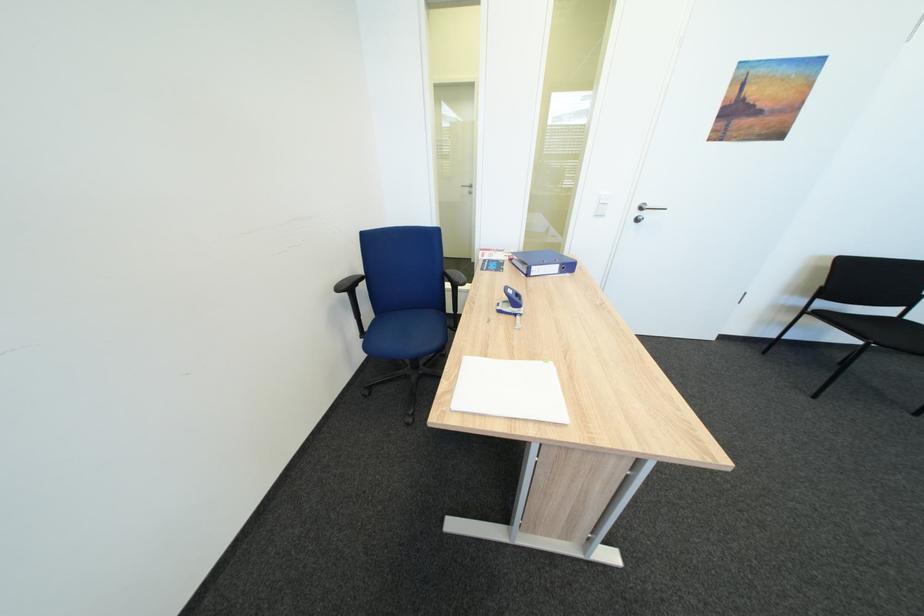
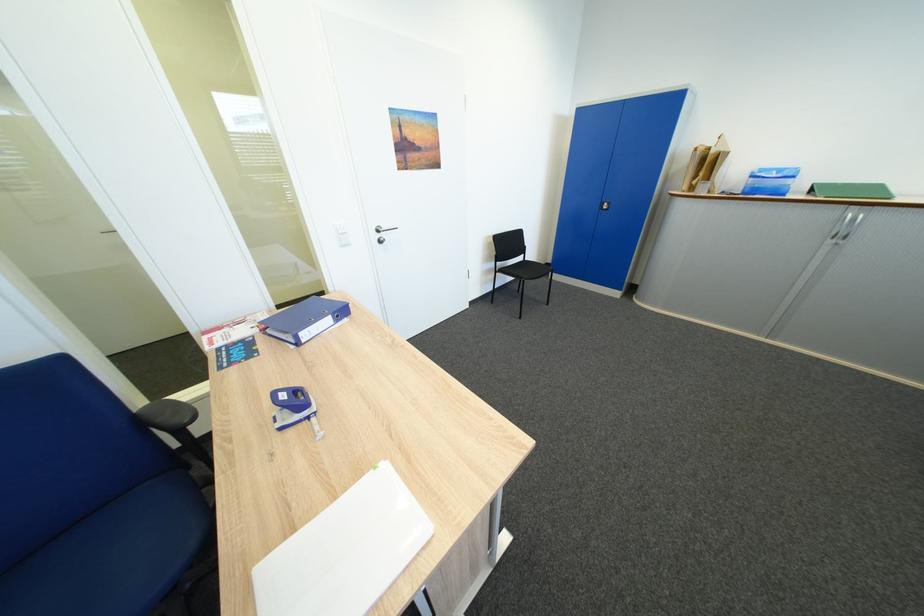
In the second image, find the point that corresponds to point 543,269 in the first image.

(310, 334)